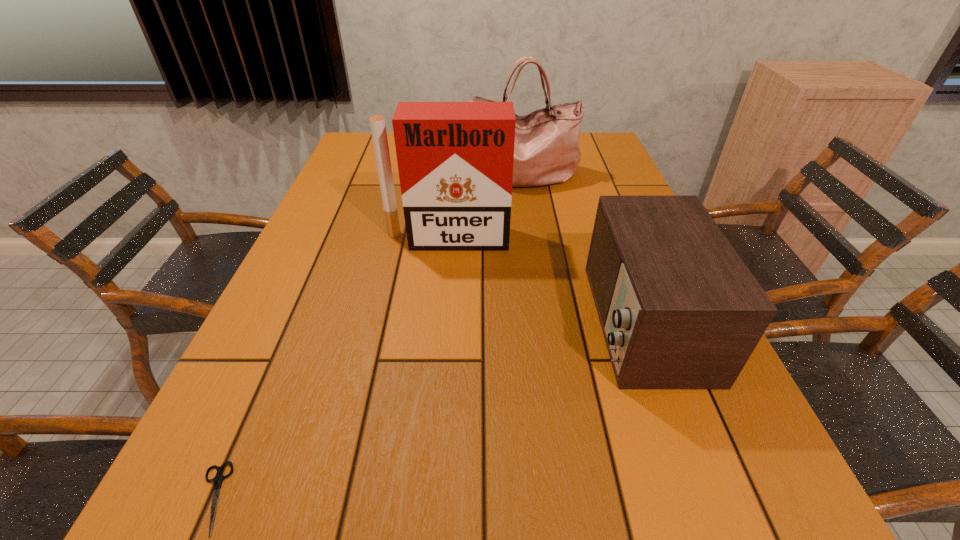
What are the coordinates of `free space located on the front-facing side of the second shortest object` in the screenshot? It's located at (464, 321).

In order to click on free space located 0.130m on the back of the leftmost object in this screenshot , I will do 258,392.

You are a GUI agent. You are given a task and a screenshot of the screen. Output one action in this format:
    pyautogui.click(x=<x>, y=<y>)
    Task: Click on the object at the far edge
    
    Given the screenshot: What is the action you would take?
    pyautogui.click(x=546, y=151)

Where is `object positioned at the near edge`? object positioned at the near edge is located at coordinates (217, 481).

Identify the location of object present at the left edge. (217, 481).

At what (x,y) coordinates should I click in order to perform the action: click on handbag that is at the right edge. Please return your answer as a coordinate pair (x, y). Looking at the image, I should click on (546, 151).

Identify the location of radio receiver present at the right edge. (679, 309).

The height and width of the screenshot is (540, 960). In order to click on object located in the near left corner section of the desktop in this screenshot , I will do `click(217, 481)`.

Where is `object that is at the far right corner`? This screenshot has width=960, height=540. object that is at the far right corner is located at coordinates (546, 151).

In the image, there is a desktop. What are the coordinates of `free space at the near edge` in the screenshot? It's located at tap(513, 509).